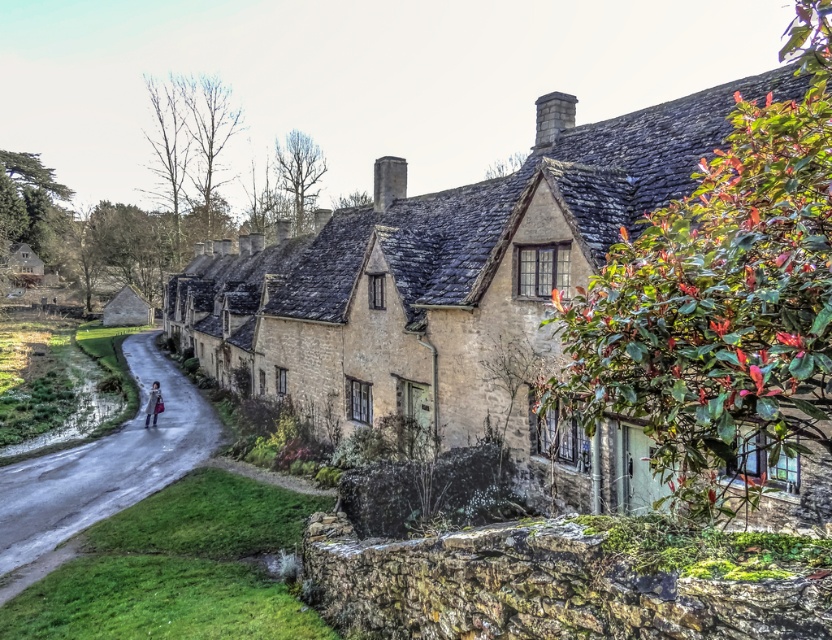
Can you confirm if stone cottage at center is positioned above matte pink coat at road center?

Yes.

Who is more distant from viewer, (x=722, y=124) or (x=156, y=387)?

Positioned behind is point (x=156, y=387).

Where is `stone cottage at center`? The width and height of the screenshot is (832, 640). stone cottage at center is located at coordinates (443, 276).

The width and height of the screenshot is (832, 640). I want to click on stone cottage at center, so click(443, 276).